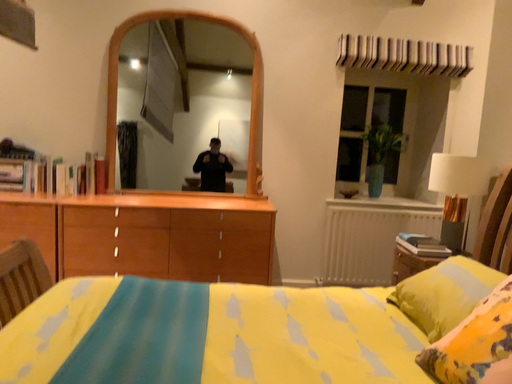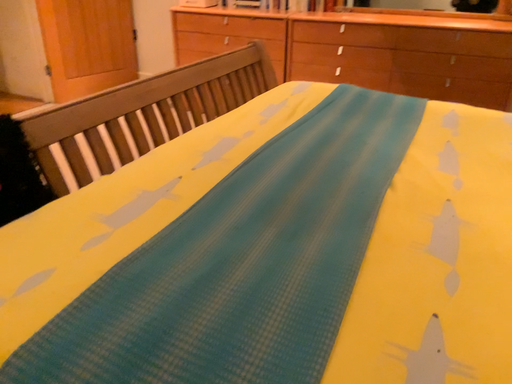
Question: How did the camera likely rotate when shooting the video?

Choices:
 (A) rotated downward
 (B) rotated upward

Answer: (A)